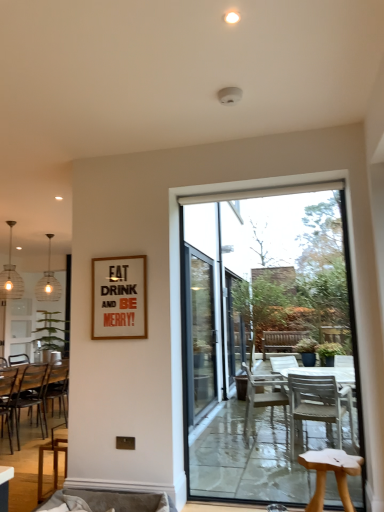
This screenshot has height=512, width=384. Find the location of `blank space situated above matte glass pendant light at left, the 1th lamp when ordered from front to back (from a real-world perspective)`. blank space situated above matte glass pendant light at left, the 1th lamp when ordered from front to back (from a real-world perspective) is located at coordinates (11, 222).